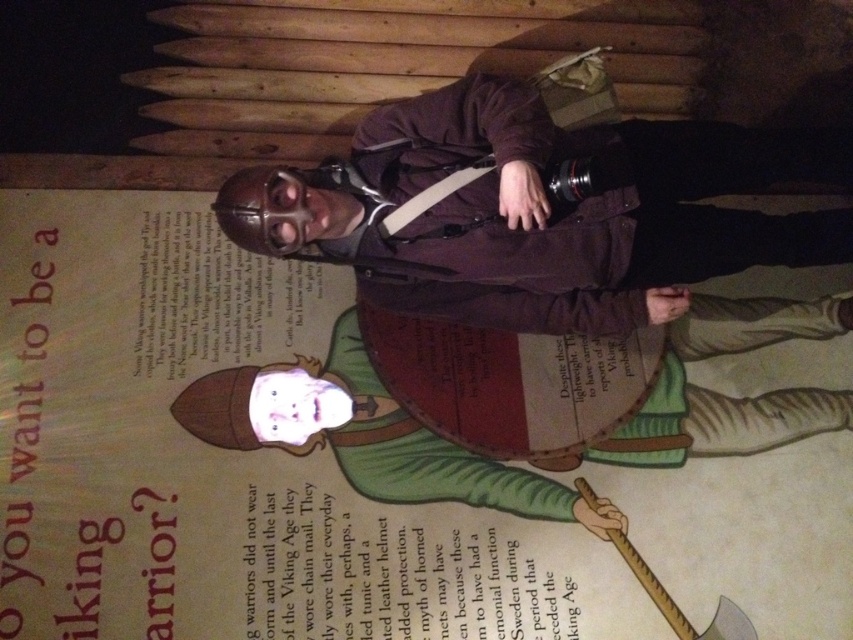
Question: Which of the following is the farthest from the observer?

Choices:
 (A) matte brown leather helmet at upper center
 (B) green leather shield at center

Answer: (B)

Question: Does matte brown leather helmet at upper center lie in front of green leather shield at center?

Choices:
 (A) no
 (B) yes

Answer: (B)

Question: Does matte brown leather helmet at upper center come behind green leather shield at center?

Choices:
 (A) no
 (B) yes

Answer: (A)

Question: Is matte brown leather helmet at upper center to the left of green leather shield at center from the viewer's perspective?

Choices:
 (A) no
 (B) yes

Answer: (A)

Question: Which of the following is the farthest from the observer?

Choices:
 (A) (791, 332)
 (B) (701, 161)

Answer: (A)